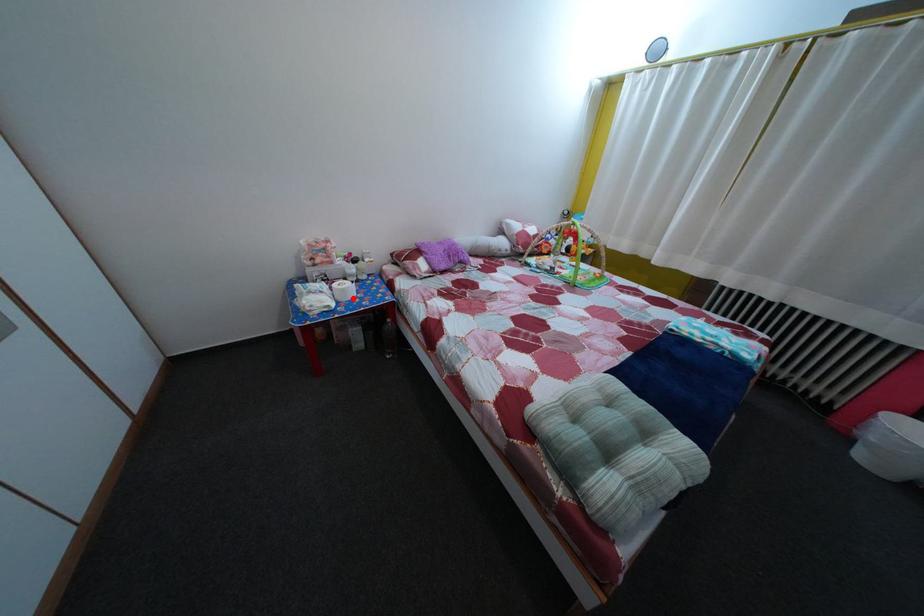
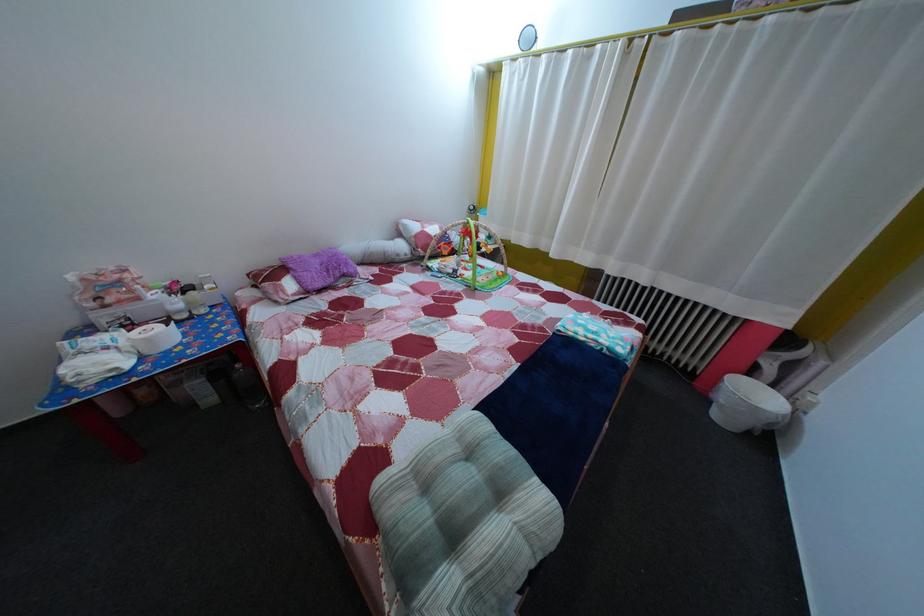
In the second image, find the point that corresponds to the highlighted location in the first image.

(157, 347)